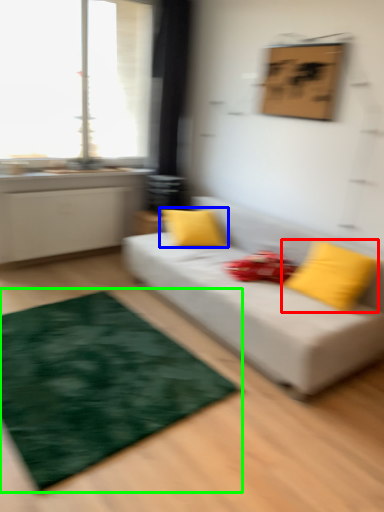
Question: Estimate the real-world distances between objects in this image. Which object is farther from pillow (highlighted by a red box), pillow (highlighted by a blue box) or mat (highlighted by a green box)?

Choices:
 (A) pillow
 (B) mat

Answer: (B)